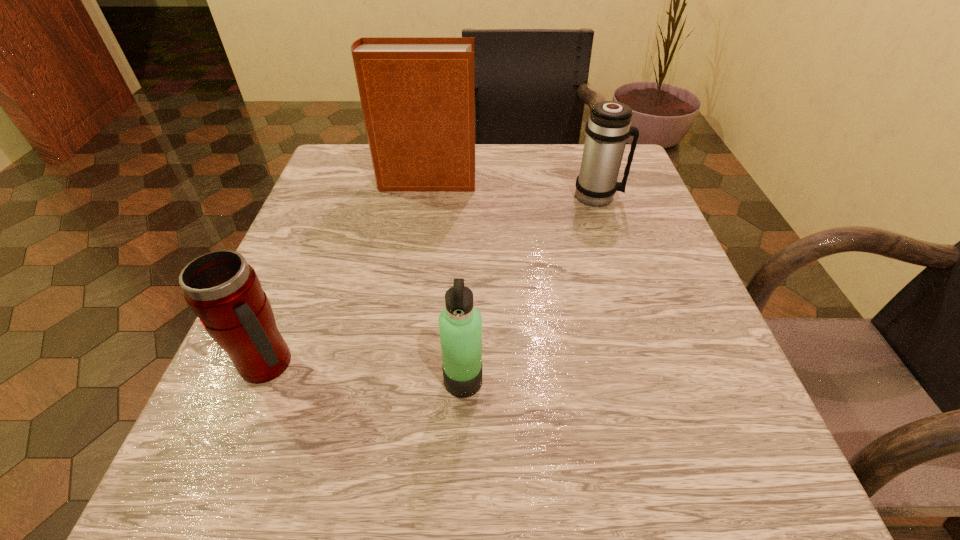
The image size is (960, 540). In order to click on empty space that is in between the leftmost object and the rightmost object in this screenshot , I will do `click(433, 280)`.

Locate which object ranks third in proximity to the hardback book. Please provide its 2D coordinates. Your answer should be formatted as a tuple, i.e. [(x, y)], where the tuple contains the x and y coordinates of a point satisfying the conditions above.

[(460, 324)]

Identify the location of the third closest object to the second thermos bottle from right to left. The height and width of the screenshot is (540, 960). (417, 94).

Identify which thermos bottle is the nearest to the leftmost thermos bottle. Please provide its 2D coordinates. Your answer should be formatted as a tuple, i.e. [(x, y)], where the tuple contains the x and y coordinates of a point satisfying the conditions above.

[(460, 324)]

The image size is (960, 540). Identify the location of thermos bottle that is the closest one to the second thermos bottle from right to left. (224, 291).

Locate an element on the screen. blank area in the image that satisfies the following two spatial constraints: 1. on the open cover of the second thermos bottle from right to left; 2. on the right side of the hardback book is located at coordinates (396, 381).